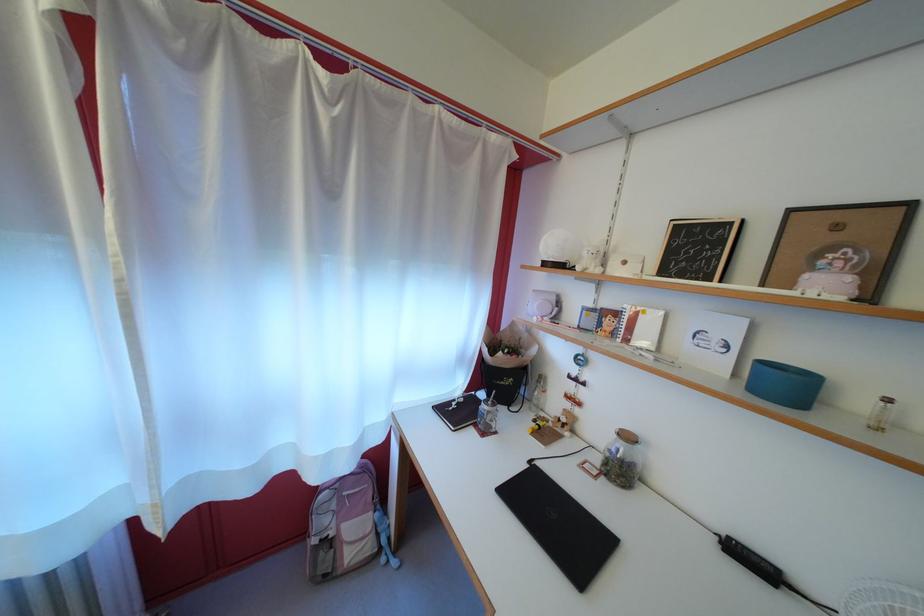
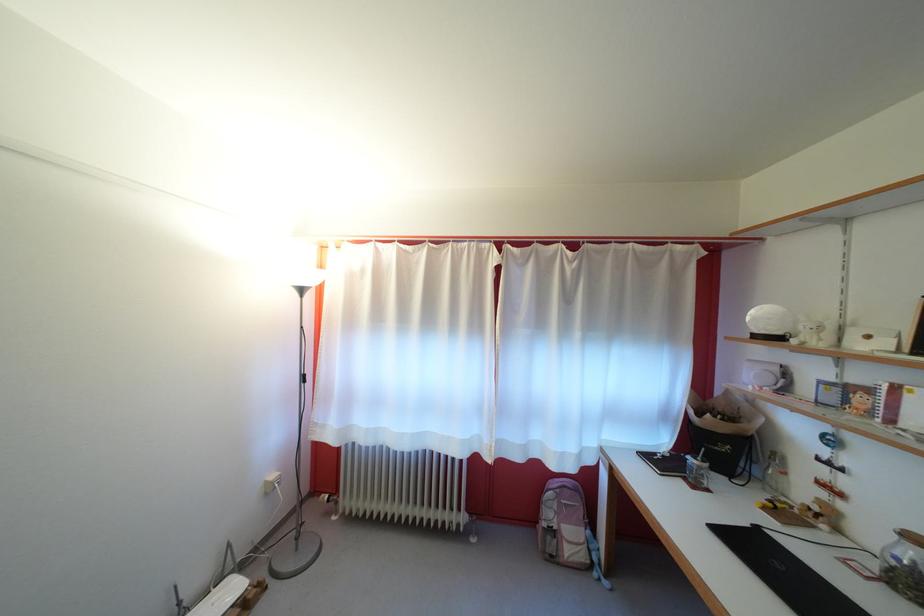
Find the pixel in the second image that matches pixel 612 320 in the first image.

(855, 395)